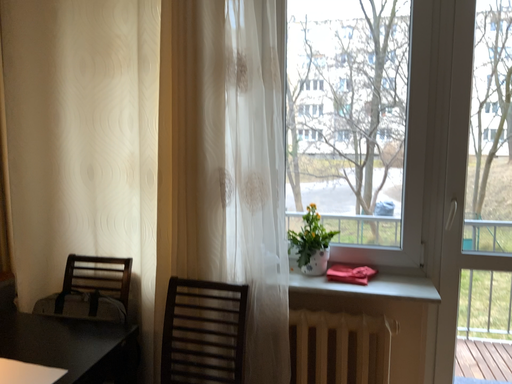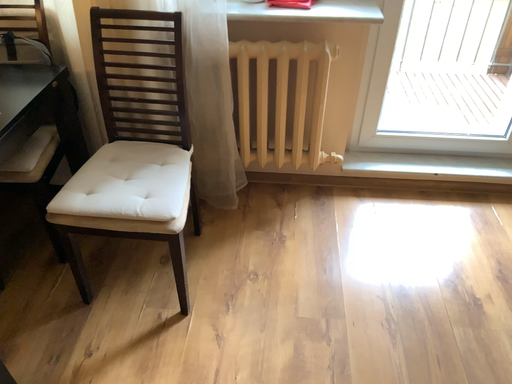
Question: Which way did the camera rotate in the video?

Choices:
 (A) rotated right
 (B) rotated left

Answer: (A)